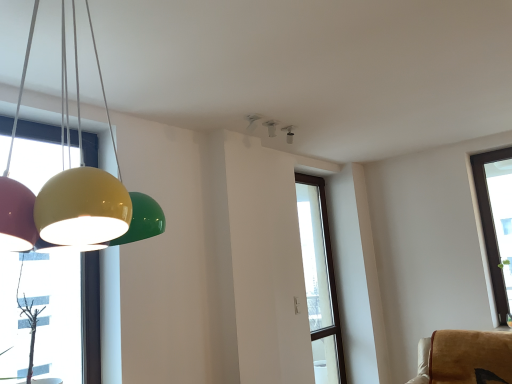
Question: Is white glossy light fixture at upper center, marked as the 1th lamp in a top-to-bottom arrangement, facing towards glossy plastic lampshade at left, the first lamp viewed from the front?

Choices:
 (A) no
 (B) yes

Answer: (A)

Question: Can you confirm if white glossy light fixture at upper center, marked as the 1th lamp in a top-to-bottom arrangement, is taller than glossy plastic lampshade at left, placed as the 2th lamp when sorted from top to bottom?

Choices:
 (A) no
 (B) yes

Answer: (A)

Question: Is white glossy light fixture at upper center, marked as the second lamp in a left-to-right arrangement, bigger than glossy plastic lampshade at left, arranged as the second lamp when viewed from the right?

Choices:
 (A) no
 (B) yes

Answer: (A)

Question: Is white glossy light fixture at upper center, marked as the 1th lamp in a top-to-bottom arrangement, looking in the opposite direction of glossy plastic lampshade at left, arranged as the first lamp when viewed from the left?

Choices:
 (A) no
 (B) yes

Answer: (A)

Question: From the image's perspective, is white glossy light fixture at upper center, which ranks as the first lamp in back-to-front order, on top of glossy plastic lampshade at left, arranged as the first lamp when viewed from the left?

Choices:
 (A) yes
 (B) no

Answer: (A)

Question: Is white glossy light fixture at upper center, positioned as the second lamp in front-to-back order, in front of glossy plastic lampshade at left, the first lamp viewed from the front?

Choices:
 (A) yes
 (B) no

Answer: (B)

Question: From the image's perspective, does glossy plastic lampshade at left, the first lamp viewed from the front, appear higher than white glossy light fixture at upper center, marked as the first lamp in a right-to-left arrangement?

Choices:
 (A) yes
 (B) no

Answer: (B)

Question: Is the depth of glossy plastic lampshade at left, the 1th lamp ordered from the bottom, greater than that of white glossy light fixture at upper center, positioned as the second lamp in front-to-back order?

Choices:
 (A) yes
 (B) no

Answer: (B)

Question: Does glossy plastic lampshade at left, the 1th lamp ordered from the bottom, have a larger size compared to white glossy light fixture at upper center, positioned as the second lamp in front-to-back order?

Choices:
 (A) yes
 (B) no

Answer: (A)

Question: Could you tell me if glossy plastic lampshade at left, placed as the 2th lamp when sorted from top to bottom, is turned towards white glossy light fixture at upper center, marked as the first lamp in a right-to-left arrangement?

Choices:
 (A) yes
 (B) no

Answer: (B)

Question: Is glossy plastic lampshade at left, the first lamp viewed from the front, looking in the opposite direction of white glossy light fixture at upper center, positioned as the second lamp in bottom-to-top order?

Choices:
 (A) no
 (B) yes

Answer: (A)

Question: From the image's perspective, is glossy plastic lampshade at left, the 1th lamp ordered from the bottom, below white glossy light fixture at upper center, marked as the first lamp in a right-to-left arrangement?

Choices:
 (A) yes
 (B) no

Answer: (A)

Question: Can white glossy light fixture at upper center, marked as the 1th lamp in a top-to-bottom arrangement, be found inside transparent glass window at center?

Choices:
 (A) no
 (B) yes

Answer: (A)